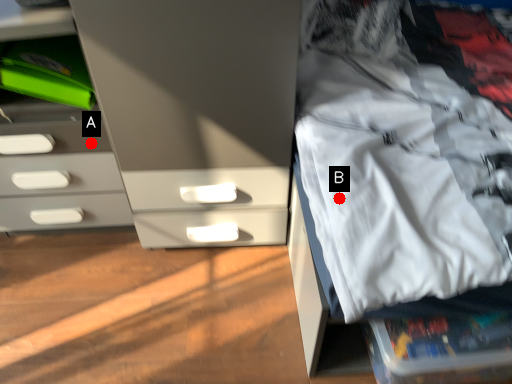
Question: Two points are circled on the image, labeled by A and B beside each circle. Among these points, which one is nearest to the camera?

Choices:
 (A) A is closer
 (B) B is closer

Answer: (B)